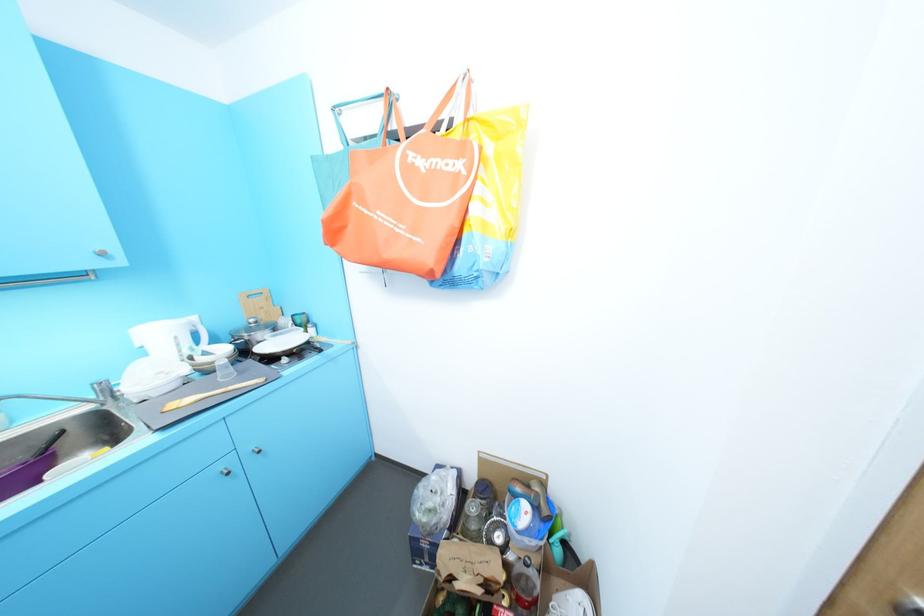
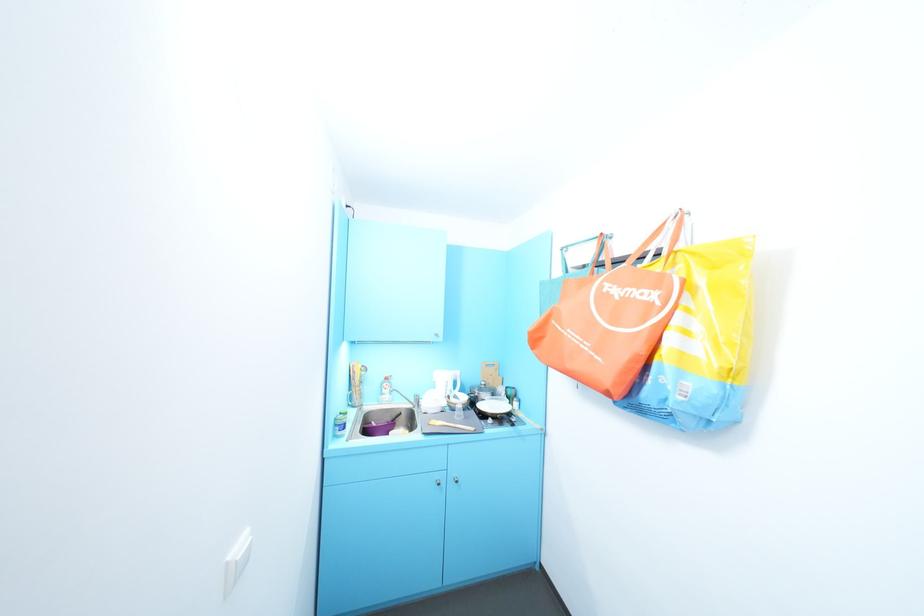
Find the pixel in the second image that matches (x=162, y=395) in the first image.

(436, 411)